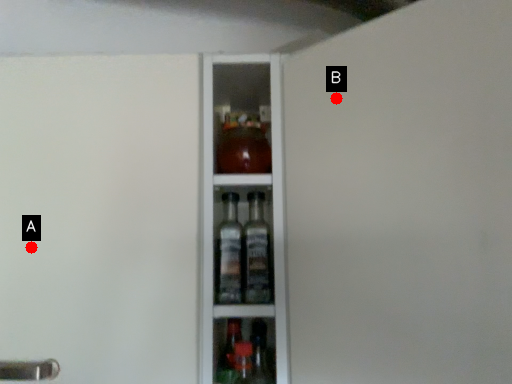
Question: Two points are circled on the image, labeled by A and B beside each circle. Which point is farther from the camera taking this photo?

Choices:
 (A) A is further
 (B) B is further

Answer: (A)